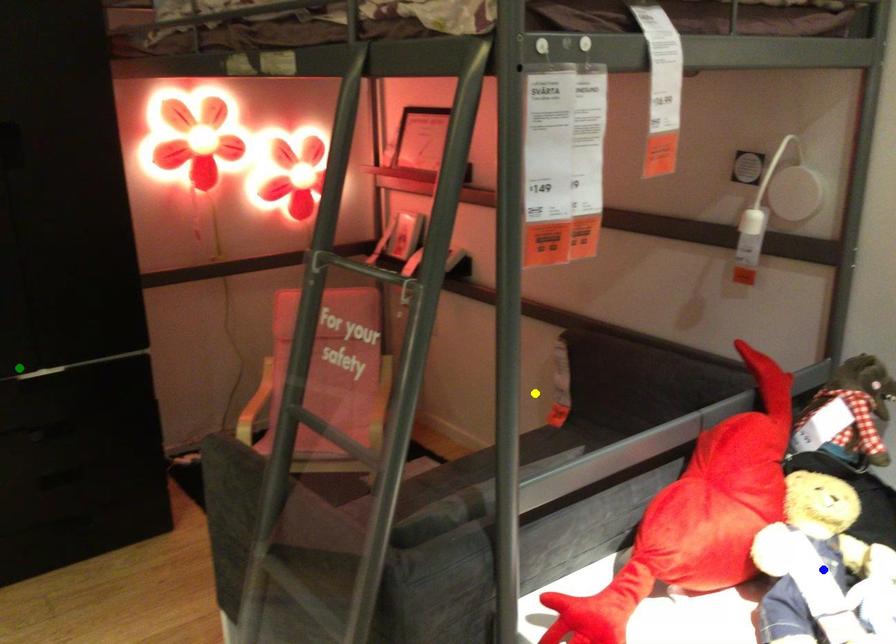
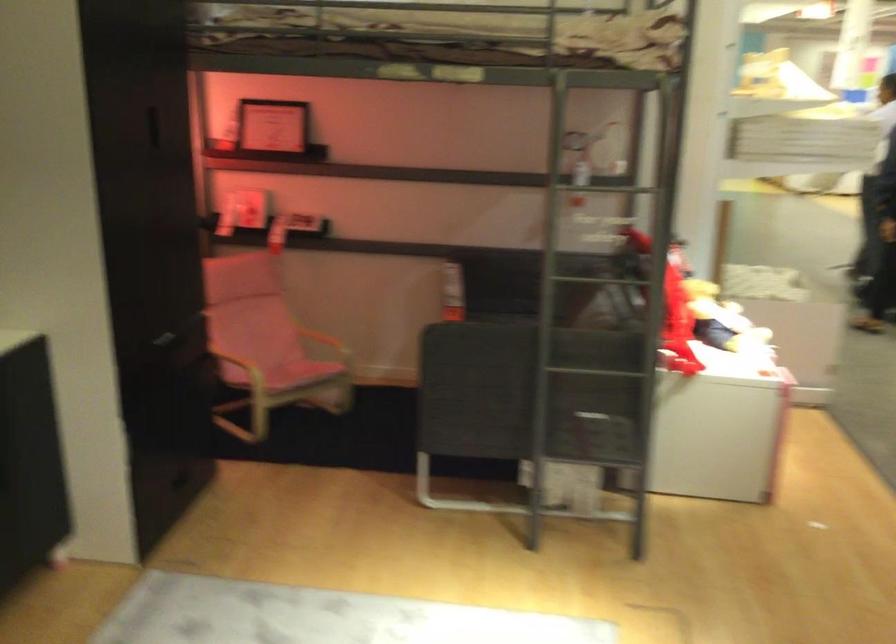
I am providing you with two images of the same scene from different viewpoints. Three points are marked in image1. Which point corresponds to a part or object that is occluded in image2?In image1, three points are marked. Which of them correspond to a part or object that is occluded in image2?Among the three points shown in image1, which one corresponds to a part or object that is no longer visible due to occlusion in image2?

blue point, green point